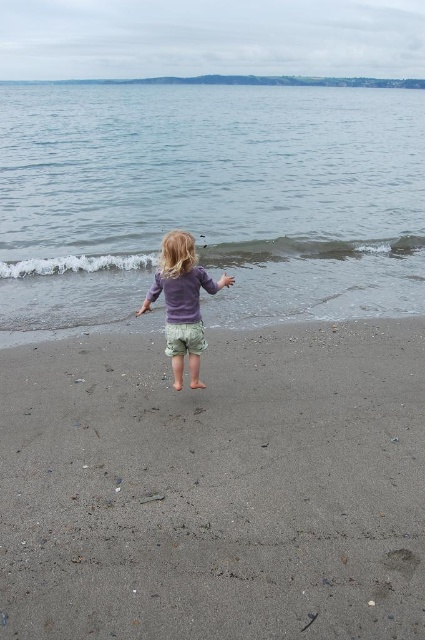
You are standing on the beach and want to reach the sandy area at center. If you take three steps forward, each step covering 3 feet, will you reach the sandy at center?

The sandy at center is 9.84 feet away from you. Taking three steps of 3 feet each would cover 9 feet, so you would still be 0.84 feet away from the sandy at center.

You are a photographer trying to capture the child in the scene. You want to position yourself so that the blue water at center and the purple cotton shirt at center are both visible in the frame. Based on their positions, should you stand to the left or right of the child to ensure both objects are in the shot?

The blue water at center is to the left of the purple cotton shirt at center, so standing to the right of the child would allow you to see both objects in the frame.

You are a photographer taking a picture of the beach scene. You notice two points marked in the image. The first point is at coordinate point (x=323, y=202) and the second is at point (x=152, y=292). Which point is closer to your camera?

Point (x=152, y=292) is closer to the camera than point (x=323, y=202).